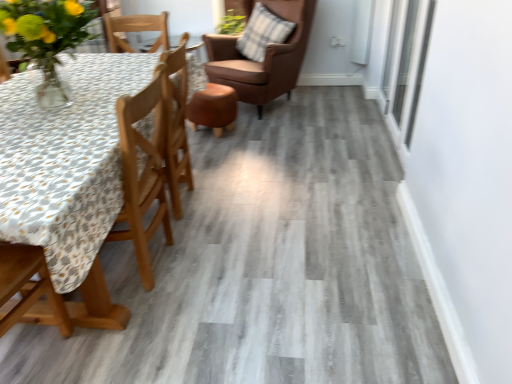
Question: From a real-world perspective, is translucent glass vase at upper left located beneath wooden chair at left, which is the first chair in left-to-right order?

Choices:
 (A) yes
 (B) no

Answer: (B)

Question: Is translucent glass vase at upper left touching wooden chair at left, which ranks as the 2th chair in back-to-front order?

Choices:
 (A) yes
 (B) no

Answer: (B)

Question: Is translucent glass vase at upper left not within wooden chair at left, which ranks as the 2th chair in back-to-front order?

Choices:
 (A) yes
 (B) no

Answer: (A)

Question: Is translucent glass vase at upper left oriented towards wooden chair at left, positioned as the second chair in top-to-bottom order?

Choices:
 (A) no
 (B) yes

Answer: (A)

Question: Is translucent glass vase at upper left oriented away from wooden chair at left, which ranks as the 2th chair in back-to-front order?

Choices:
 (A) yes
 (B) no

Answer: (B)

Question: Considering the relative sizes of translucent glass vase at upper left and wooden chair at left, positioned as the second chair in top-to-bottom order, in the image provided, is translucent glass vase at upper left smaller than wooden chair at left, positioned as the second chair in top-to-bottom order,?

Choices:
 (A) no
 (B) yes

Answer: (B)

Question: Is brown leather chair at upper center, the second chair positioned from the bottom, taller than wooden chair at left, which is the first chair in left-to-right order?

Choices:
 (A) yes
 (B) no

Answer: (A)

Question: Does brown leather chair at upper center, the second chair positioned from the bottom, come in front of wooden chair at left, which is the first chair in left-to-right order?

Choices:
 (A) yes
 (B) no

Answer: (B)

Question: From the image's perspective, would you say brown leather chair at upper center, the second chair positioned from the bottom, is positioned over wooden chair at left, which appears as the second chair when viewed from the right?

Choices:
 (A) no
 (B) yes

Answer: (B)

Question: From a real-world perspective, is brown leather chair at upper center, arranged as the first chair when viewed from the back, beneath wooden chair at left, positioned as the second chair in top-to-bottom order?

Choices:
 (A) no
 (B) yes

Answer: (A)

Question: Considering the relative sizes of brown leather chair at upper center, arranged as the first chair when viewed from the back, and wooden chair at left, which ranks as the 2th chair in back-to-front order, in the image provided, is brown leather chair at upper center, arranged as the first chair when viewed from the back, smaller than wooden chair at left, which ranks as the 2th chair in back-to-front order,?

Choices:
 (A) no
 (B) yes

Answer: (A)

Question: Is brown leather chair at upper center, marked as the second chair in a left-to-right arrangement, not near wooden chair at left, positioned as the second chair in top-to-bottom order?

Choices:
 (A) yes
 (B) no

Answer: (A)

Question: Is plaid fabric pillow at upper right completely or partially outside of transparent glass window at upper right?

Choices:
 (A) yes
 (B) no

Answer: (A)